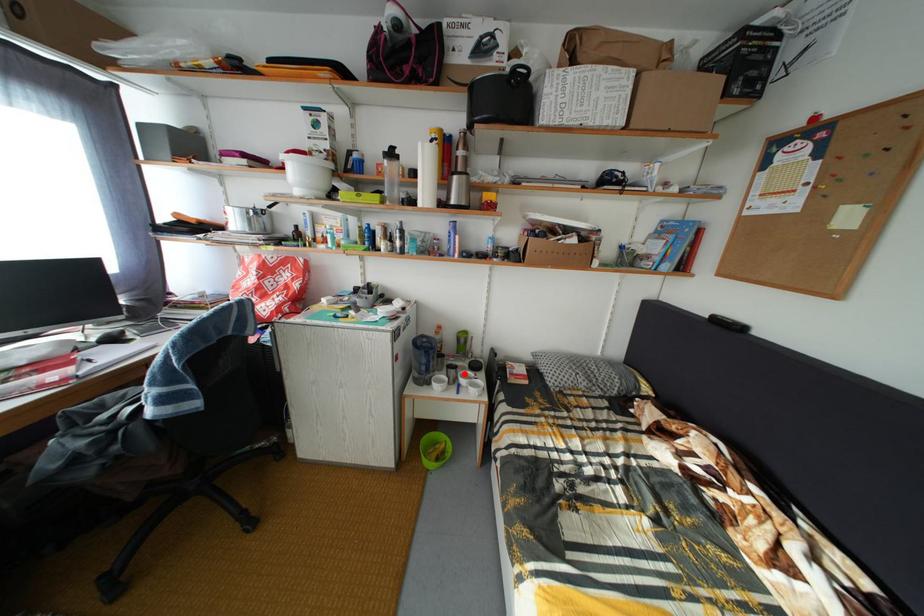
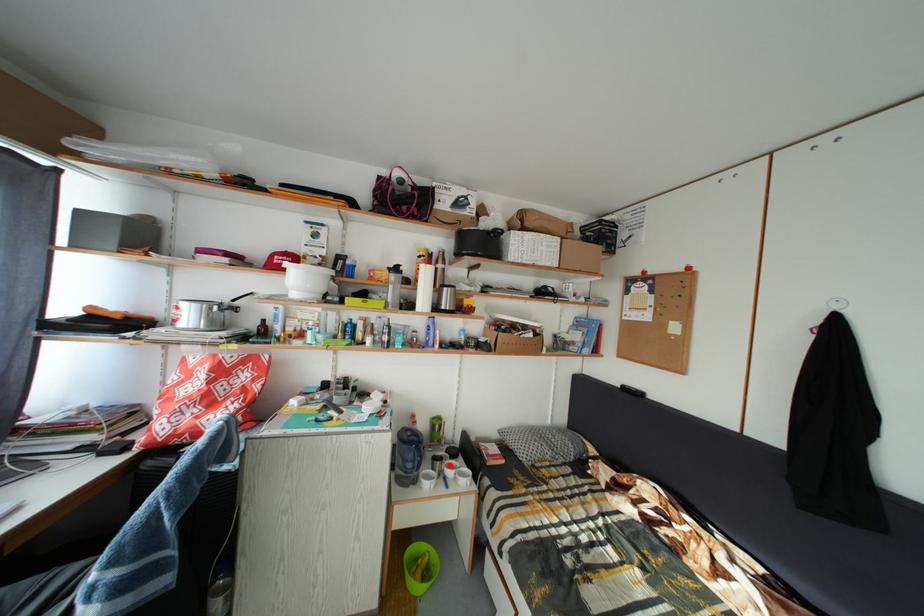
I am providing you with two images of the same scene from different viewpoints. A red point is marked on the first image and another point is marked on the second image. Are the points marked in image1 and image2 representing the same 3D position?

Yes